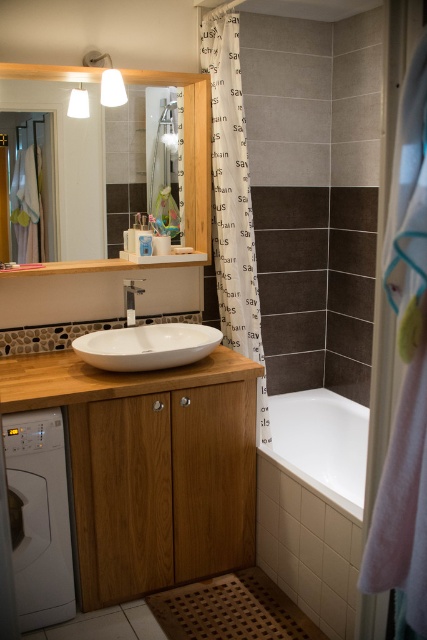
Question: Is white wood vanity at center wider than white glossy washer at lower left?

Choices:
 (A) yes
 (B) no

Answer: (A)

Question: Estimate the real-world distances between objects in this image. Which object is farther from the white glossy mirror at upper center?

Choices:
 (A) white glossy washer at lower left
 (B) white wood vanity at center
 (C) pink fabric towel at right
 (D) white wood counter top at center

Answer: (C)

Question: Which object is farther from the camera taking this photo?

Choices:
 (A) pink fabric towel at right
 (B) white glossy bathtub at lower right

Answer: (B)

Question: Among these points, which one is farthest from the camera?

Choices:
 (A) (406, 336)
 (B) (96, 346)

Answer: (B)

Question: Can you confirm if pink fabric towel at right is bigger than satin nickel faucet at center?

Choices:
 (A) yes
 (B) no

Answer: (A)

Question: Considering the relative positions of pink fabric towel at right and white glossy sink at center in the image provided, where is pink fabric towel at right located with respect to white glossy sink at center?

Choices:
 (A) below
 (B) above

Answer: (A)